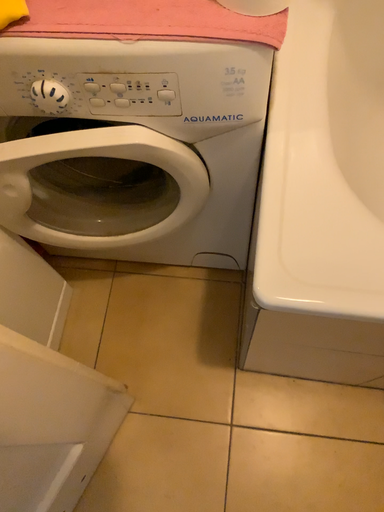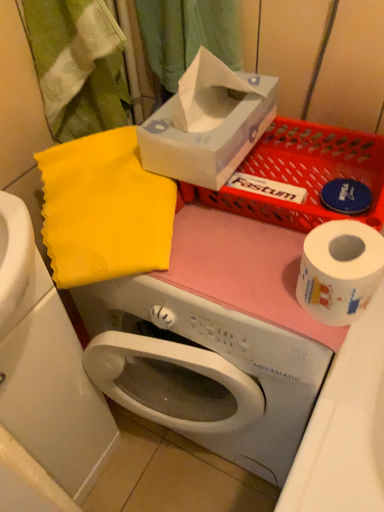
Question: Which way did the camera rotate in the video?

Choices:
 (A) rotated left
 (B) rotated right

Answer: (A)